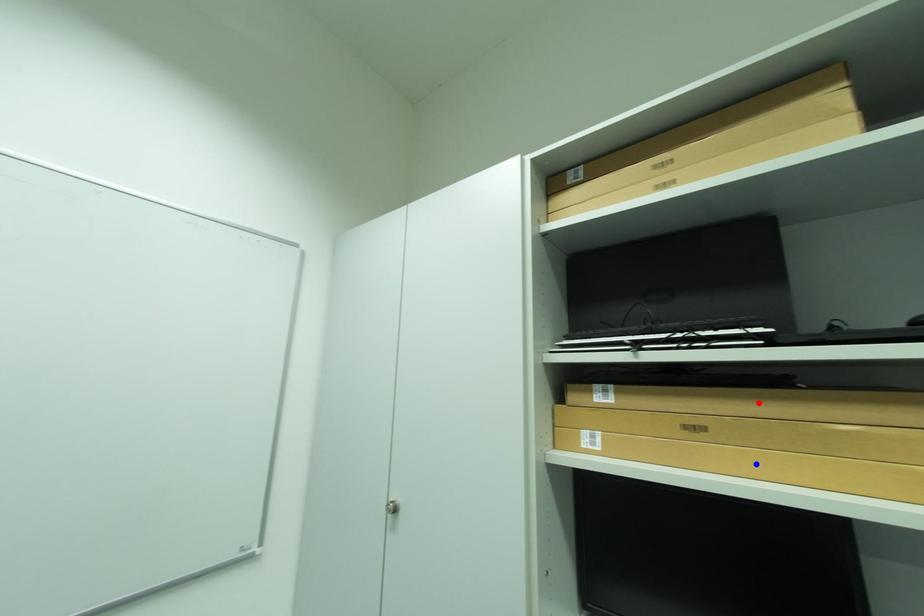
Question: Which of the two points in the image is closer to the camera?

Choices:
 (A) Blue point is closer.
 (B) Red point is closer.

Answer: (A)